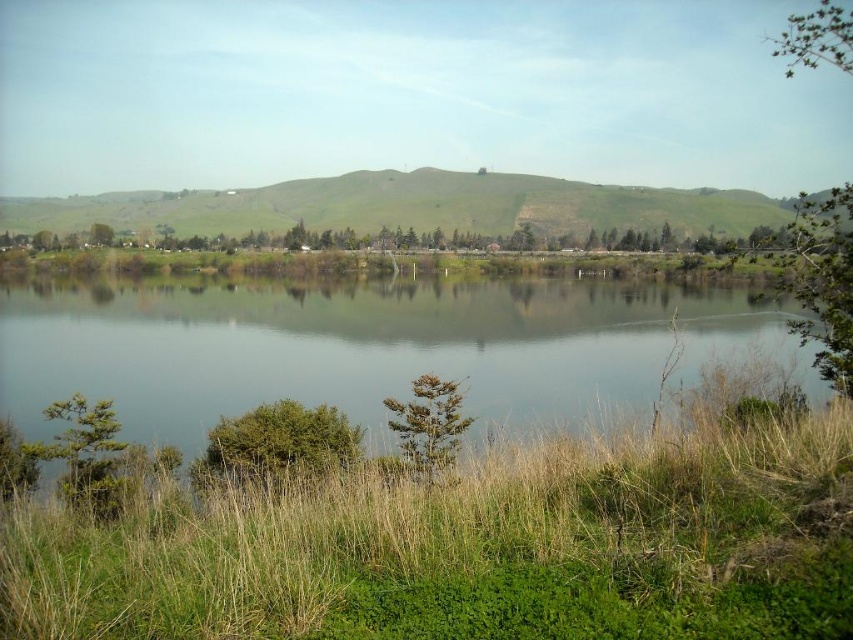
Question: Does green grass at lower center have a greater width compared to transparent water at center?

Choices:
 (A) yes
 (B) no

Answer: (B)

Question: Is the position of green grass at lower center more distant than that of transparent water at center?

Choices:
 (A) yes
 (B) no

Answer: (B)

Question: Where is green grass at lower center located in relation to transparent water at center in the image?

Choices:
 (A) above
 (B) below

Answer: (B)

Question: Which of the following is the farthest from the observer?

Choices:
 (A) (16, 390)
 (B) (744, 470)

Answer: (A)

Question: Among these points, which one is farthest from the camera?

Choices:
 (A) (488, 385)
 (B) (735, 480)

Answer: (A)